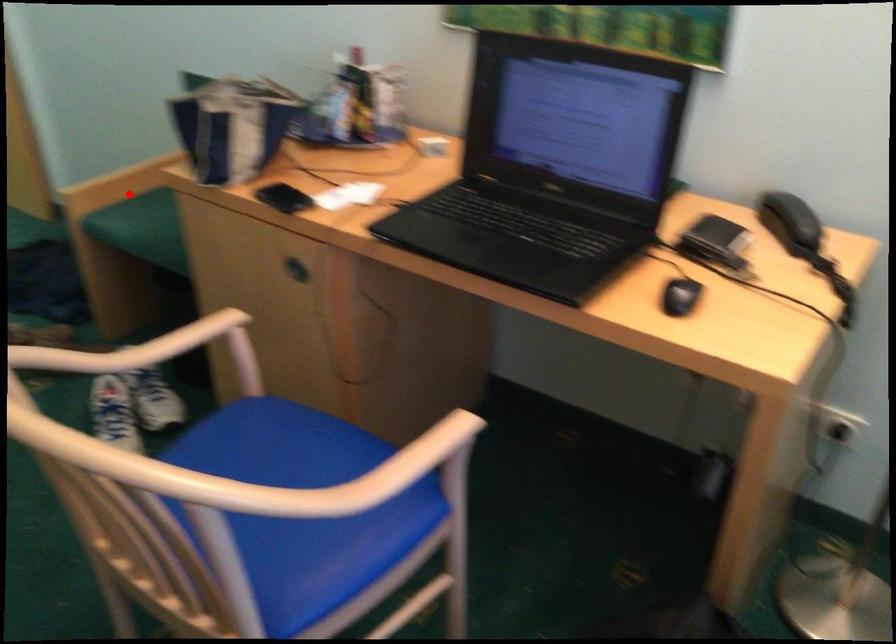
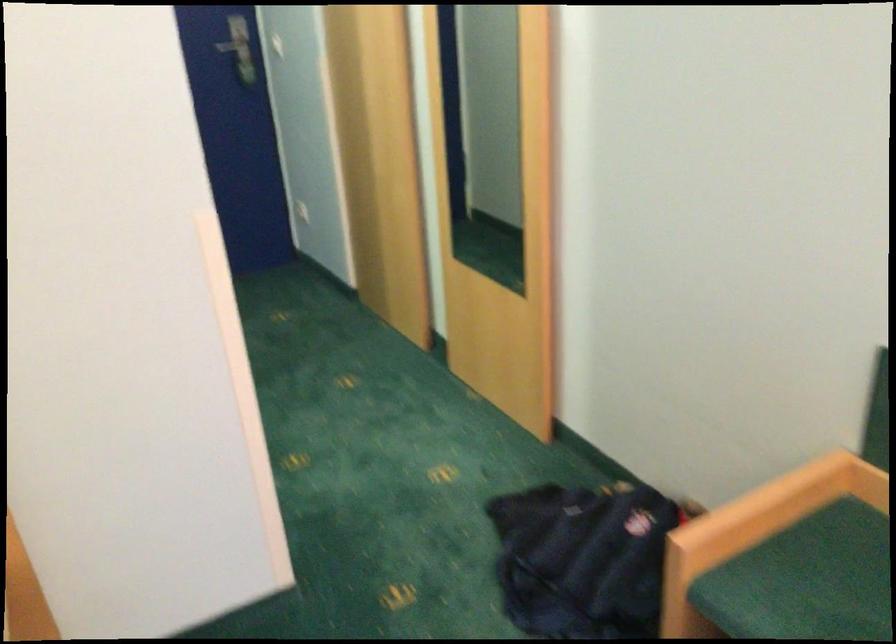
The point at the highlighted location is marked in the first image. Where is the corresponding point in the second image?

(756, 529)